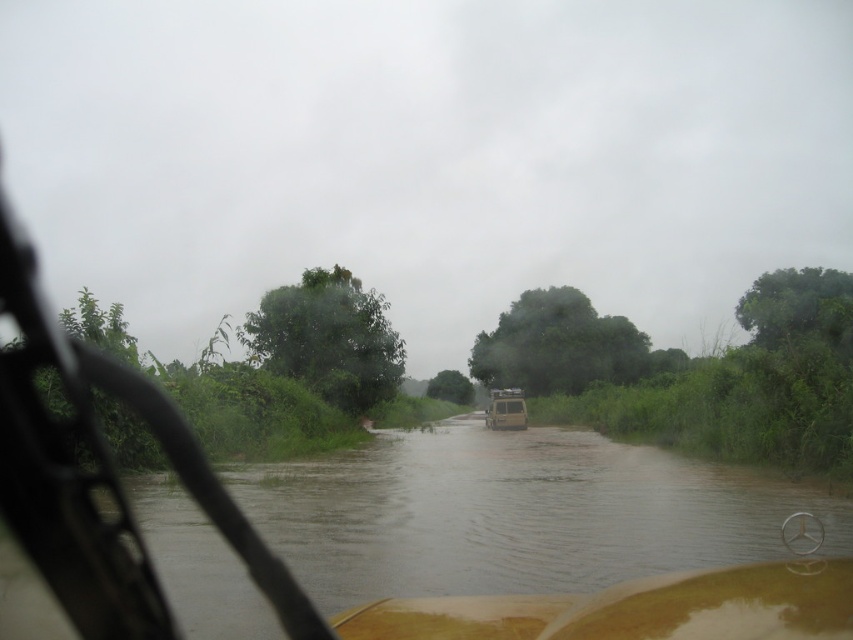
Question: Which point appears closest to the camera in this image?

Choices:
 (A) (502, 397)
 (B) (252, 504)

Answer: (B)

Question: Is the position of brown muddy river at center more distant than that of metallic silver jeep at center?

Choices:
 (A) yes
 (B) no

Answer: (B)

Question: Is brown muddy river at center bigger than metallic silver jeep at center?

Choices:
 (A) yes
 (B) no

Answer: (A)

Question: Which object is closer to the camera taking this photo?

Choices:
 (A) metallic silver jeep at center
 (B) brown muddy river at center

Answer: (B)

Question: Which object appears farthest from the camera in this image?

Choices:
 (A) brown muddy river at center
 (B) metallic silver jeep at center

Answer: (B)

Question: Considering the relative positions of brown muddy river at center and metallic silver jeep at center in the image provided, where is brown muddy river at center located with respect to metallic silver jeep at center?

Choices:
 (A) left
 (B) right

Answer: (A)